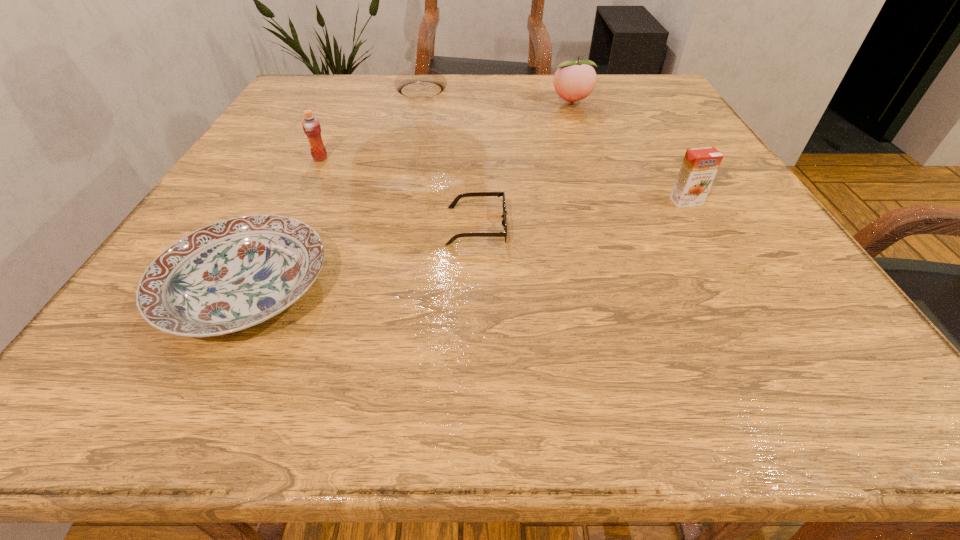
Image resolution: width=960 pixels, height=540 pixels. In order to click on blank space located 0.340m on the right of the farther orange juice in this screenshot , I will do `click(494, 158)`.

Find the location of `free spot located 0.190m on the back of the rightmost object`. free spot located 0.190m on the back of the rightmost object is located at coordinates 654,144.

Find the location of a particular element. This screenshot has height=540, width=960. blank space located on the right of the plate is located at coordinates (595, 288).

At what (x,y) coordinates should I click in order to perform the action: click on free space located on the front-facing side of the sunglasses. Please return your answer as a coordinate pair (x, y). The width and height of the screenshot is (960, 540). Looking at the image, I should click on (554, 226).

The image size is (960, 540). I want to click on table lamp located at the far edge, so click(x=419, y=82).

This screenshot has height=540, width=960. I want to click on peach located at the far edge, so click(573, 81).

Locate an element on the screen. object that is at the near edge is located at coordinates (233, 274).

The width and height of the screenshot is (960, 540). I want to click on orange juice present at the left edge, so click(311, 126).

In order to click on plate positioned at the left edge in this screenshot , I will do `click(233, 274)`.

Where is `object that is positioned at the right edge`? The width and height of the screenshot is (960, 540). object that is positioned at the right edge is located at coordinates (699, 167).